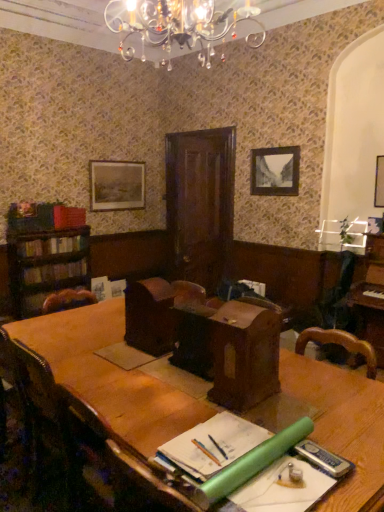
Where is `matte red bookshelf at left, which is counted as the first book, starting from the top`? matte red bookshelf at left, which is counted as the first book, starting from the top is located at coordinates (68, 217).

This screenshot has height=512, width=384. Describe the element at coordinates (68, 217) in the screenshot. I see `matte red bookshelf at left, placed as the 3th book when sorted from bottom to top` at that location.

What do you see at coordinates (116, 185) in the screenshot? This screenshot has height=512, width=384. I see `wooden picture frame at upper left, marked as the first picture frame in a back-to-front arrangement` at bounding box center [116, 185].

What are the coordinates of `crystal chandelier at upper center` in the screenshot? It's located at (180, 26).

What do you see at coordinates (230, 350) in the screenshot? I see `wooden desk at center` at bounding box center [230, 350].

Identify the location of brown leather armchair at center, which is the 2th armchair in left-to-right order. (193, 329).

Describe the element at coordinates (109, 375) in the screenshot. I see `wooden table at center` at that location.

You are a GUI agent. You are given a task and a screenshot of the screen. Output one action in this format:
    pyautogui.click(x=<x>, y=<y>)
    Task: Click on the matte red bookshelf at left, placed as the 3th book when sorted from bottom to top
    
    Given the screenshot: What is the action you would take?
    pyautogui.click(x=68, y=217)

From a real-world perspective, starting from the brown leather armchair at center, the 2th armchair positioned from the right, which book is the 1st one below it? Please provide its 2D coordinates.

[(52, 245)]

Does hardcover books at left, the second book from the top, have a larger size compared to brown leather armchair at center, the first armchair when ordered from left to right?

Correct, hardcover books at left, the second book from the top, is larger in size than brown leather armchair at center, the first armchair when ordered from left to right.

How distant is hardcover books at left, which is the second book in bottom-to-top order, from brown leather armchair at center, the 2th armchair positioned from the right?

hardcover books at left, which is the second book in bottom-to-top order, and brown leather armchair at center, the 2th armchair positioned from the right, are 5.01 feet apart.

Can you confirm if hardcover books at left, the second book from the top, is positioned to the right of brown leather armchair at center, the 2th armchair positioned from the right?

No.

The width and height of the screenshot is (384, 512). I want to click on picture frame that is the 1st one when counting downward from the crystal chandelier at upper center (from the image's perspective), so click(x=116, y=185).

Which object is positioned more to the right, crystal chandelier at upper center or wooden picture frame at upper left, which is counted as the 1th picture frame, starting from the left?

Positioned to the right is crystal chandelier at upper center.

Can you confirm if crystal chandelier at upper center is smaller than wooden picture frame at upper left, which is counted as the 1th picture frame, starting from the left?

Actually, crystal chandelier at upper center might be larger than wooden picture frame at upper left, which is counted as the 1th picture frame, starting from the left.

From a real-world perspective, between crystal chandelier at upper center and wooden picture frame at upper left, the third picture frame positioned from the right, who is vertically lower?

wooden picture frame at upper left, the third picture frame positioned from the right.

Is wooden desk at center surrounded by wooden picture frame at upper left, the third picture frame positioned from the right?

No, wooden desk at center is not inside wooden picture frame at upper left, the third picture frame positioned from the right.

Considering the relative positions of wooden picture frame at upper left, the third picture frame positioned from the right, and wooden desk at center in the image provided, is wooden picture frame at upper left, the third picture frame positioned from the right, to the right of wooden desk at center from the viewer's perspective?

No.

Is wooden picture frame at upper left, which is counted as the 1th picture frame, starting from the left, placed right next to wooden desk at center?

No, wooden picture frame at upper left, which is counted as the 1th picture frame, starting from the left, is not next to wooden desk at center.

Considering the points (92, 206) and (214, 349), which point is in front, point (92, 206) or point (214, 349)?

The point (214, 349) is closer.

Who is taller, wooden table at center or crystal chandelier at upper center?

wooden table at center.

From the image's perspective, is wooden table at center on crystal chandelier at upper center?

No, from the image's perspective, wooden table at center is not over crystal chandelier at upper center.

From a real-world perspective, is wooden table at center under crystal chandelier at upper center?

Correct, in the physical world, wooden table at center is lower than crystal chandelier at upper center.

Is crystal chandelier at upper center surrounded by wooden table at center?

No.

Which object is thinner, wooden picture frame at upper center, which is the second picture frame from left to right, or wooden table at center?

wooden picture frame at upper center, which is the second picture frame from left to right, is thinner.

Considering the sizes of objects wooden picture frame at upper center, placed as the second picture frame when sorted from front to back, and wooden table at center in the image provided, who is bigger, wooden picture frame at upper center, placed as the second picture frame when sorted from front to back, or wooden table at center?

wooden table at center.

Identify the location of table on the left of wooden picture frame at upper center, the 2th picture frame when ordered from back to front. This screenshot has height=512, width=384. (109, 375).

From the image's perspective, which is above, dark brown leather bookshelf at left, placed as the first book when sorted from bottom to top, or wooden picture frame at upper left, marked as the first picture frame in a back-to-front arrangement?

From the image's view, wooden picture frame at upper left, marked as the first picture frame in a back-to-front arrangement, is above.

Measure the distance between dark brown leather bookshelf at left, placed as the first book when sorted from bottom to top, and wooden picture frame at upper left, which is counted as the 1th picture frame, starting from the left.

The distance of dark brown leather bookshelf at left, placed as the first book when sorted from bottom to top, from wooden picture frame at upper left, which is counted as the 1th picture frame, starting from the left, is 2.03 meters.

Does point (34, 281) come in front of point (106, 201)?

Yes, it is in front of point (106, 201).

What's the angular difference between dark brown leather bookshelf at left, arranged as the third book when viewed from the top, and wooden picture frame at upper left, which is the third picture frame from front to back,'s facing directions?

There is a 0.509-degree angle between the facing directions of dark brown leather bookshelf at left, arranged as the third book when viewed from the top, and wooden picture frame at upper left, which is the third picture frame from front to back.

Looking at this image, could you tell me if wooden picture frame at upper left, which is counted as the 1th picture frame, starting from the left, is turned towards matte red bookshelf at left, which is counted as the first book, starting from the top?

No, wooden picture frame at upper left, which is counted as the 1th picture frame, starting from the left, is not facing towards matte red bookshelf at left, which is counted as the first book, starting from the top.

There is a wooden picture frame at upper left, the third picture frame positioned from the right. Identify the location of the 1st book below it (from the image's perspective). This screenshot has height=512, width=384. (68, 217).

From the image's perspective, does wooden picture frame at upper left, which is the third picture frame from front to back, appear higher than matte red bookshelf at left, placed as the 3th book when sorted from bottom to top?

Yes, from the image's perspective, wooden picture frame at upper left, which is the third picture frame from front to back, is over matte red bookshelf at left, placed as the 3th book when sorted from bottom to top.

Is point (120, 199) farther from camera compared to point (81, 218)?

That is True.

From the image's perspective, which armchair is the 1st one below the hardcover books at left, which is the second book in bottom-to-top order? Please provide its 2D coordinates.

[(150, 316)]

You are a GUI agent. You are given a task and a screenshot of the screen. Output one action in this format:
    pyautogui.click(x=<x>, y=<y>)
    Task: Click on the picture frame on the left side of crystal chandelier at upper center
    
    Given the screenshot: What is the action you would take?
    pyautogui.click(x=116, y=185)

Estimate the real-world distances between objects in this image. Which object is further from wooden picture frame at upper center, which is the second picture frame from left to right, wooden chair at lower left or brown leather armchair at center, the first armchair when ordered from left to right?

Among the two, wooden chair at lower left is located further to wooden picture frame at upper center, which is the second picture frame from left to right.

Looking at the image, which one is located closer to dark brown leather bookshelf at left, placed as the first book when sorted from bottom to top, hardcover books at left, the second book from the top, or wooden picture frame at upper left, the third picture frame positioned from the right?

hardcover books at left, the second book from the top, is closer to dark brown leather bookshelf at left, placed as the first book when sorted from bottom to top.

Which object lies further to the anchor point crystal chandelier at upper center, dark brown leather bookshelf at left, arranged as the third book when viewed from the top, or brown leather armchair at center, which appears as the first armchair when viewed from the right?

dark brown leather bookshelf at left, arranged as the third book when viewed from the top, is further to crystal chandelier at upper center.

Considering their positions, is wooden table at center positioned further to wooden desk at center than dark brown leather bookshelf at left, placed as the first book when sorted from bottom to top?

dark brown leather bookshelf at left, placed as the first book when sorted from bottom to top, is further to wooden desk at center.

Looking at the image, which one is located further to brown leather armchair at center, which is the 2th armchair in left-to-right order, dark brown leather bookshelf at left, arranged as the third book when viewed from the top, or wooden picture frame at upper center, the 2th picture frame positioned from the right?

Based on the image, wooden picture frame at upper center, the 2th picture frame positioned from the right, appears to be further to brown leather armchair at center, which is the 2th armchair in left-to-right order.

When comparing their distances from wooden picture frame at upper left, which is counted as the 1th picture frame, starting from the left, does brown leather armchair at center, the 2th armchair positioned from the right, or brown leather armchair at center, which is the 2th armchair in left-to-right order, seem closer?

brown leather armchair at center, the 2th armchair positioned from the right.

Looking at the image, which one is located further to wooden chair at lower left, hardcover books at left, which is the second book in bottom-to-top order, or crystal chandelier at upper center?

crystal chandelier at upper center.

Consider the image. Estimate the real-world distances between objects in this image. Which object is closer to wooden desk at center, wooden picture frame at upper center, the 2th picture frame when ordered from back to front, or wooden chair at lower left?

wooden chair at lower left is closer to wooden desk at center.

Locate an element on the screen. chair between wooden table at center and dark brown leather bookshelf at left, arranged as the third book when viewed from the top, along the z-axis is located at coordinates pos(64,431).

This screenshot has width=384, height=512. Identify the location of picture frame located between hardcover books at left, the second book from the top, and wooden picture frame at upper center, the 2th picture frame when ordered from back to front, in the left-right direction. (116, 185).

At what (x,y) coordinates should I click in order to perform the action: click on chair between wooden desk at center and dark brown leather bookshelf at left, arranged as the third book when viewed from the top, along the z-axis. Please return your answer as a coordinate pair (x, y). Looking at the image, I should click on pyautogui.click(x=64, y=431).

What are the coordinates of `light fixture between wooden table at center and hardcover books at left, the second book from the top, from front to back` in the screenshot? It's located at (180, 26).